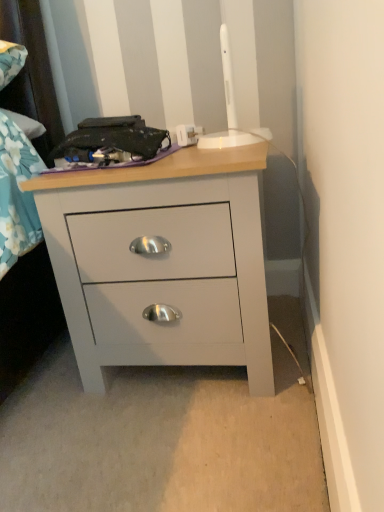
What do you see at coordinates (161, 208) in the screenshot? I see `matte gray chest of drawers at center` at bounding box center [161, 208].

What is the approximate height of matte gray chest of drawers at center?

matte gray chest of drawers at center is 19.85 inches in height.

Where is `matte gray chest of drawers at center`? The width and height of the screenshot is (384, 512). matte gray chest of drawers at center is located at coordinates (161, 208).

You are a GUI agent. You are given a task and a screenshot of the screen. Output one action in this format:
    pyautogui.click(x=<x>, y=<y>)
    Task: Click on the matte gray chest of drawers at center
    The height and width of the screenshot is (512, 384).
    Given the screenshot: What is the action you would take?
    pyautogui.click(x=161, y=208)